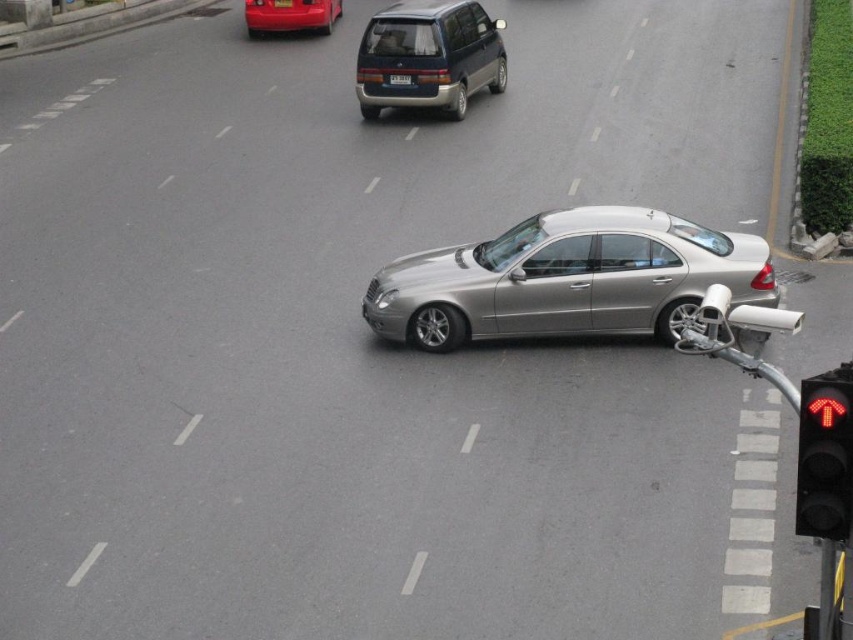
Is shiny red car at upper center bigger than black plastic license plate at center?

Correct, shiny red car at upper center is larger in size than black plastic license plate at center.

Can you confirm if shiny red car at upper center is positioned below black plastic license plate at center?

Correct, shiny red car at upper center is located below black plastic license plate at center.

Find the location of a particular element. shiny red car at upper center is located at coordinates (291, 16).

At what (x,y) coordinates should I click in order to perform the action: click on shiny red car at upper center. Please return your answer as a coordinate pair (x, y). Image resolution: width=853 pixels, height=640 pixels. Looking at the image, I should click on (291, 16).

Which is behind, point (389, 300) or point (390, 74)?

The point (390, 74) is behind.

Where is `satin silver car at center`? This screenshot has height=640, width=853. satin silver car at center is located at coordinates (567, 280).

Which is in front, point (483, 262) or point (403, 84)?

Point (483, 262)

This screenshot has height=640, width=853. I want to click on satin silver car at center, so click(567, 280).

Who is lower down, red glass traffic light at lower right or black plastic license plate at center?

red glass traffic light at lower right

Between point (808, 524) and point (282, 3), which one is positioned in front?

Point (808, 524)

The image size is (853, 640). I want to click on red glass traffic light at lower right, so click(825, 456).